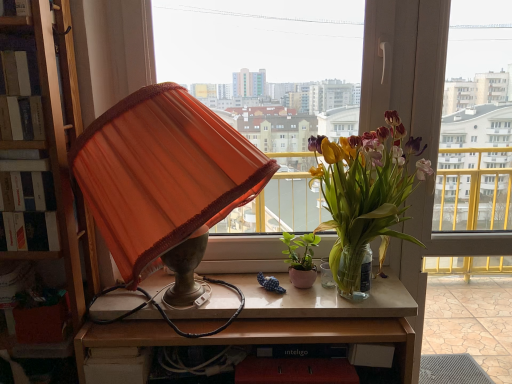
Question: Does wooden table at center have a lesser height compared to hardcover book at left?

Choices:
 (A) yes
 (B) no

Answer: (B)

Question: Is wooden table at center taller than hardcover book at left?

Choices:
 (A) yes
 (B) no

Answer: (A)

Question: Considering the relative sizes of wooden table at center and hardcover book at left in the image provided, is wooden table at center thinner than hardcover book at left?

Choices:
 (A) no
 (B) yes

Answer: (A)

Question: Considering the relative sizes of wooden table at center and hardcover book at left in the image provided, is wooden table at center wider than hardcover book at left?

Choices:
 (A) yes
 (B) no

Answer: (A)

Question: From a real-world perspective, does wooden table at center sit lower than hardcover book at left?

Choices:
 (A) no
 (B) yes

Answer: (B)

Question: Is wooden table at center inside or outside of green matte plant at center, acting as the 1th houseplant starting from the left?

Choices:
 (A) inside
 (B) outside

Answer: (B)

Question: Looking at their shapes, would you say wooden table at center is wider or thinner than green matte plant at center, arranged as the 2th houseplant when viewed from the right?

Choices:
 (A) wide
 (B) thin

Answer: (A)

Question: From the image's perspective, relative to green matte plant at center, acting as the 1th houseplant starting from the left, is wooden table at center above or below?

Choices:
 (A) below
 (B) above

Answer: (A)

Question: Is wooden table at center in front of or behind green matte plant at center, acting as the 1th houseplant starting from the left, in the image?

Choices:
 (A) behind
 (B) front

Answer: (B)

Question: From a real-world perspective, is translucent glass vase at upper right, the 2th houseplant when ordered from left to right, physically located above or below green matte plant at center, acting as the 1th houseplant starting from the left?

Choices:
 (A) below
 (B) above

Answer: (B)

Question: Based on their positions, is translucent glass vase at upper right, the first houseplant viewed from the right, located to the left or right of green matte plant at center, acting as the 1th houseplant starting from the left?

Choices:
 (A) left
 (B) right

Answer: (B)

Question: In terms of size, does translucent glass vase at upper right, the 2th houseplant when ordered from left to right, appear bigger or smaller than green matte plant at center, arranged as the 2th houseplant when viewed from the right?

Choices:
 (A) big
 (B) small

Answer: (A)

Question: Is translucent glass vase at upper right, the 2th houseplant when ordered from left to right, inside or outside of green matte plant at center, arranged as the 2th houseplant when viewed from the right?

Choices:
 (A) outside
 (B) inside

Answer: (A)

Question: Which is correct: green matte plant at center, acting as the 1th houseplant starting from the left, is inside transparent glass window at center, placed as the first window when sorted from right to left, or outside of it?

Choices:
 (A) outside
 (B) inside

Answer: (A)

Question: Considering the positions of point (313, 279) and point (498, 269), is point (313, 279) closer or farther from the camera than point (498, 269)?

Choices:
 (A) farther
 (B) closer

Answer: (B)